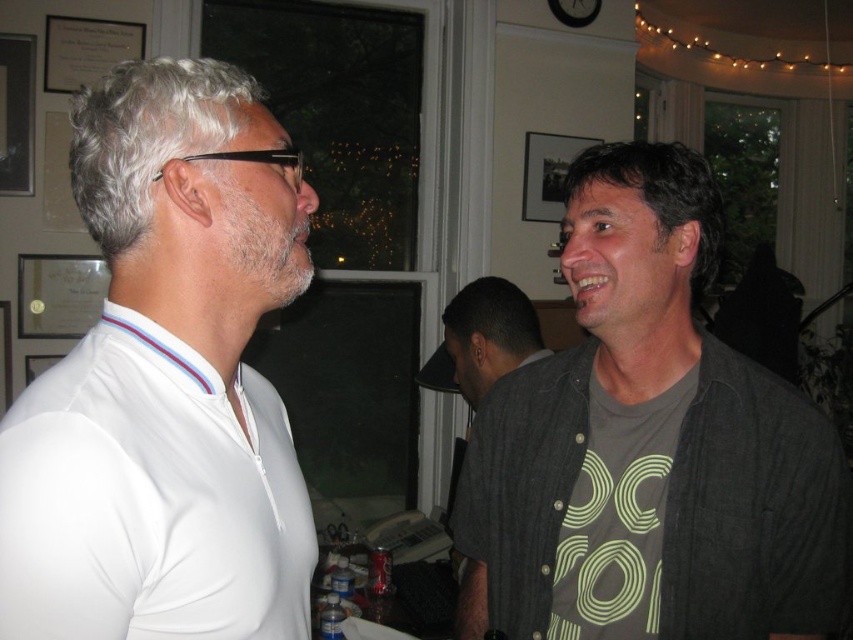
You are a photographer standing behind the dark gray shirt at right and dark gray shirt at center. You want to take a photo of both individuals in the same frame. Given that your camera has a minimum focus distance of 30 inches, will you need to step back to ensure both are in focus?

The distance between the dark gray shirt at right and dark gray shirt at center is 28.92 inches, which is less than the camera minimum focus distance of 30 inches. Therefore, you need to step back to ensure both are in focus.